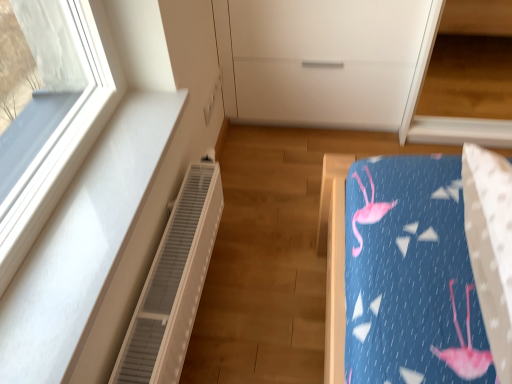
The width and height of the screenshot is (512, 384). I want to click on free space above white plastic radiator at left (from a real-world perspective), so click(170, 244).